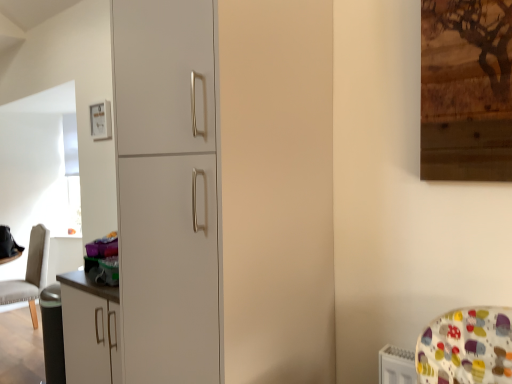
Question: Are matte white picture frame at upper left and white matte cabinet at center making contact?

Choices:
 (A) no
 (B) yes

Answer: (A)

Question: Is matte white picture frame at upper left at the left side of white matte cabinet at center?

Choices:
 (A) no
 (B) yes

Answer: (B)

Question: Is the position of matte white picture frame at upper left less distant than that of white matte cabinet at center?

Choices:
 (A) yes
 (B) no

Answer: (B)

Question: Can you confirm if matte white picture frame at upper left is positioned to the right of white matte cabinet at center?

Choices:
 (A) no
 (B) yes

Answer: (A)

Question: Does matte white picture frame at upper left have a greater width compared to white matte cabinet at center?

Choices:
 (A) yes
 (B) no

Answer: (B)

Question: Is matte white picture frame at upper left positioned behind white matte cabinet at center?

Choices:
 (A) yes
 (B) no

Answer: (A)

Question: From a real-world perspective, is white matte cabinet at center over matte white picture frame at upper left?

Choices:
 (A) no
 (B) yes

Answer: (A)

Question: Does white matte cabinet at center have a larger size compared to matte white picture frame at upper left?

Choices:
 (A) yes
 (B) no

Answer: (A)

Question: Is white matte cabinet at center surrounding matte white picture frame at upper left?

Choices:
 (A) no
 (B) yes

Answer: (A)

Question: Is white matte cabinet at center oriented towards matte white picture frame at upper left?

Choices:
 (A) no
 (B) yes

Answer: (A)

Question: From the image's perspective, does white matte cabinet at center appear higher than matte white picture frame at upper left?

Choices:
 (A) no
 (B) yes

Answer: (A)

Question: Considering the relative sizes of white matte cabinet at center and matte white picture frame at upper left in the image provided, is white matte cabinet at center thinner than matte white picture frame at upper left?

Choices:
 (A) yes
 (B) no

Answer: (B)

Question: Is white matte cabinet at center surrounding leather-like beige chair at left?

Choices:
 (A) no
 (B) yes

Answer: (A)